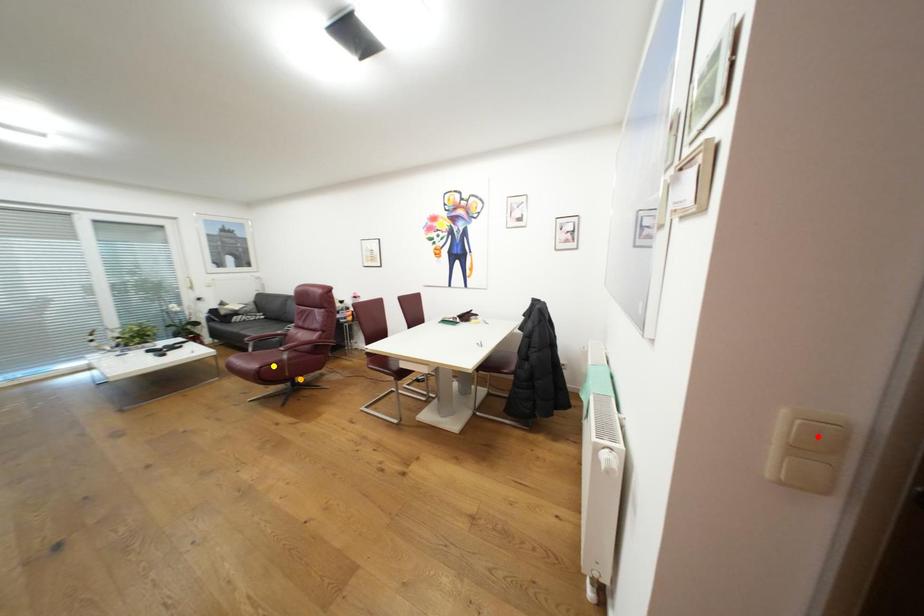
Order these from nearest to farthest:
- red point
- orange point
- yellow point

1. red point
2. yellow point
3. orange point